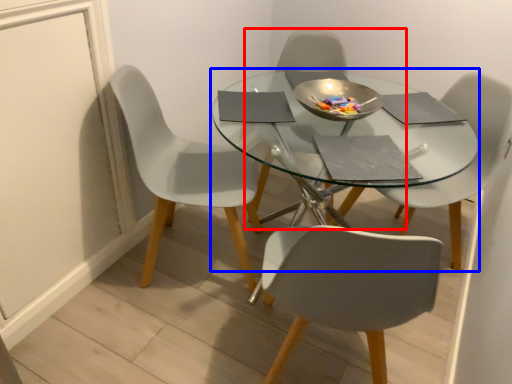
Question: Among these objects, which one is farthest to the camera, chair (highlighted by a red box) or round table (highlighted by a blue box)?

Choices:
 (A) chair
 (B) round table

Answer: (A)